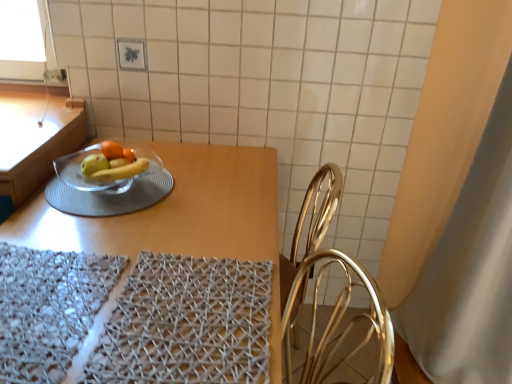
Image resolution: width=512 pixels, height=384 pixels. I want to click on vacant point above transparent glass bowl at center (from a real-world perspective), so pyautogui.click(x=117, y=193).